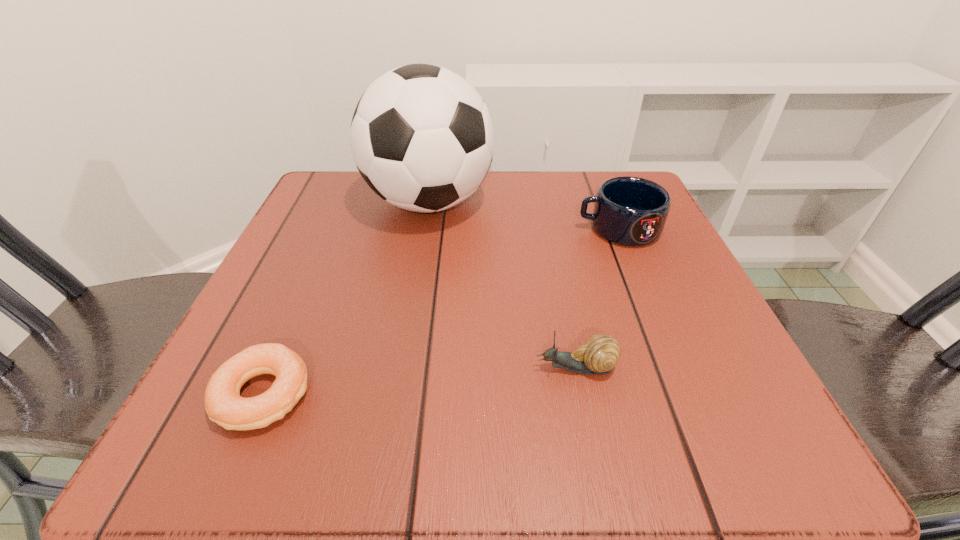
Find the location of `free space located 0.370m on the front-facing side of the third object from left to right`. free space located 0.370m on the front-facing side of the third object from left to right is located at coordinates (271, 368).

Where is `vacant area situated 0.170m on the front-facing side of the third object from left to right`? This screenshot has height=540, width=960. vacant area situated 0.170m on the front-facing side of the third object from left to right is located at coordinates (414, 368).

The height and width of the screenshot is (540, 960). Identify the location of vacant region located 0.060m on the front-facing side of the third object from left to right. (492, 368).

This screenshot has height=540, width=960. I want to click on vacant region located 0.060m on the right of the shortest object, so click(x=355, y=394).

I want to click on soccer ball located at the far edge, so click(422, 138).

In order to click on mug that is at the far edge in this screenshot , I will do `click(631, 211)`.

This screenshot has height=540, width=960. I want to click on object that is at the near edge, so click(x=224, y=405).

Where is `soccer ball at the left edge`? The image size is (960, 540). soccer ball at the left edge is located at coordinates (422, 138).

Locate an element on the screen. The height and width of the screenshot is (540, 960). bagel at the left edge is located at coordinates (224, 405).

Locate an element on the screen. The height and width of the screenshot is (540, 960). object located in the right edge section of the desktop is located at coordinates (631, 211).